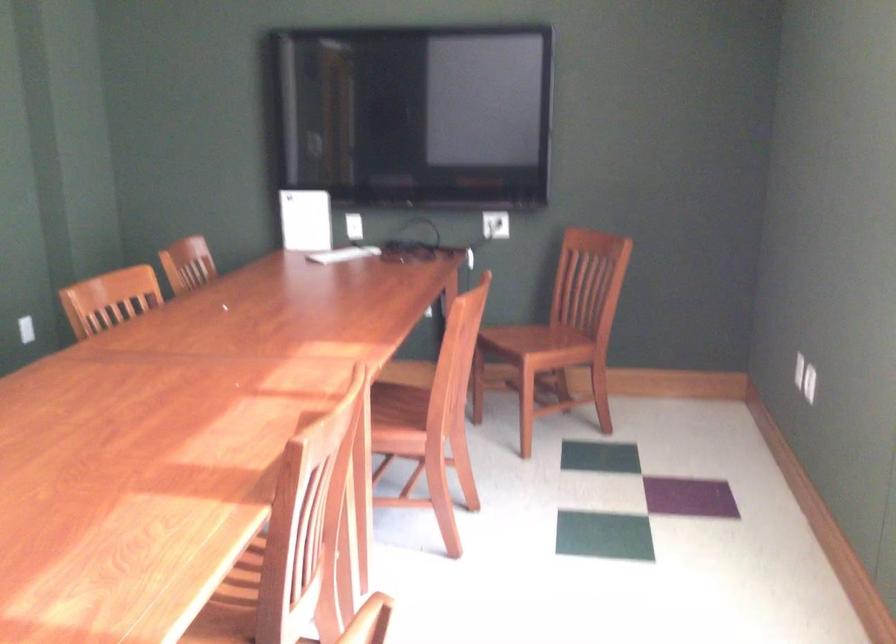
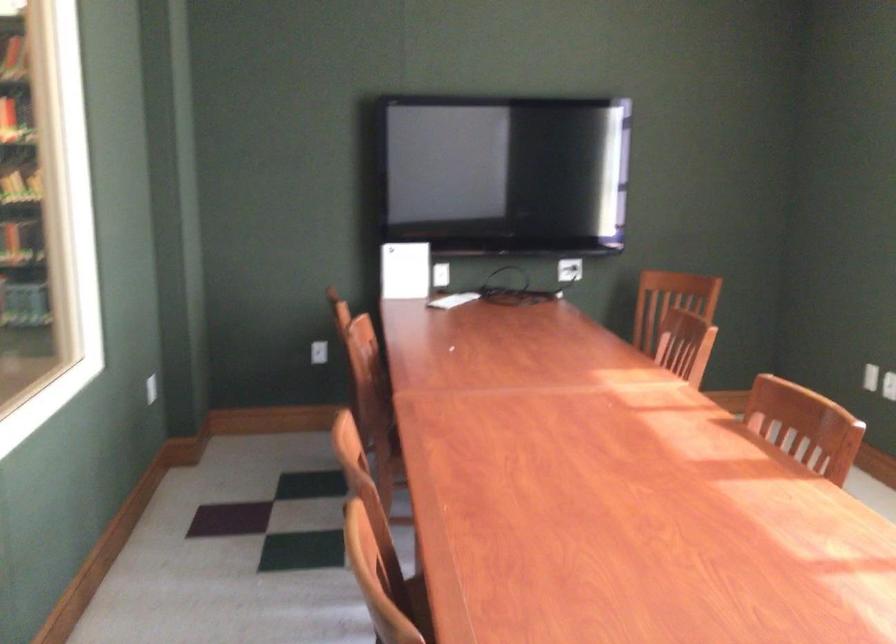
Question: The images are taken continuously from a first-person perspective. In which direction are you moving?

Choices:
 (A) Left
 (B) Right
 (C) Forward
 (D) Backward

Answer: (A)